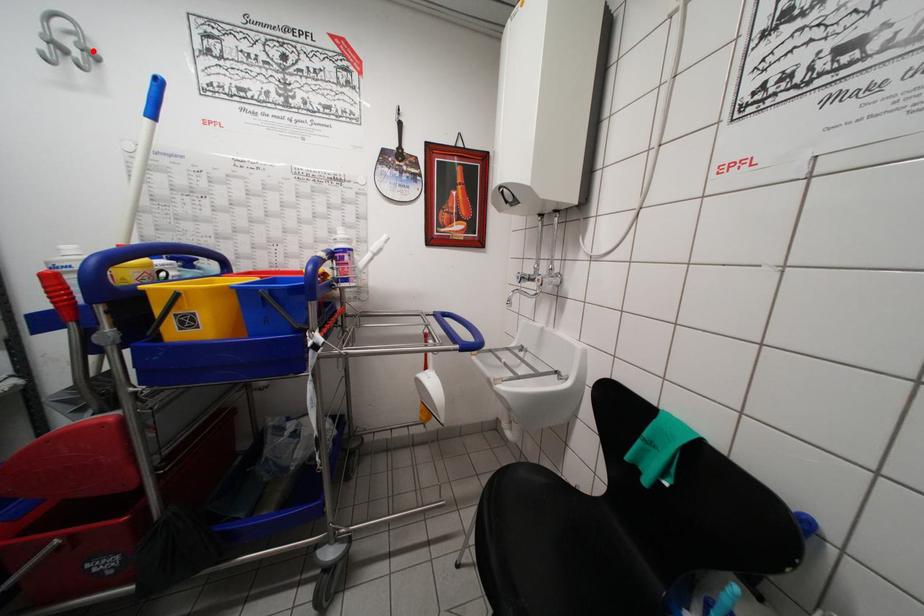
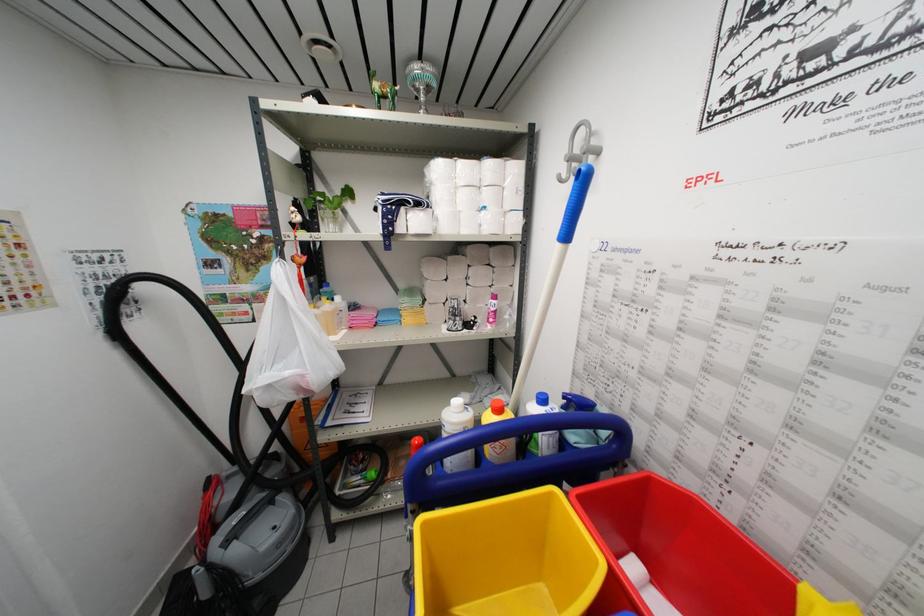
Question: A red point is marked in image1. In image2, is the corresponding 3D point closer to the camera or farther? Reply with the corresponding letter.

Choices:
 (A) The corresponding 3D point is closer.
 (B) The corresponding 3D point is farther.

Answer: (A)